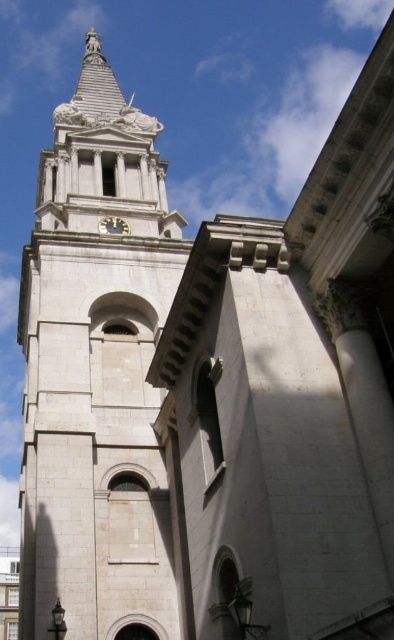
Question: Does white stone clock tower at center have a lesser width compared to black glossy clock at upper center?

Choices:
 (A) yes
 (B) no

Answer: (B)

Question: Which of the following is the closest to the observer?

Choices:
 (A) (63, 154)
 (B) (122, 224)

Answer: (B)

Question: Can you confirm if white stone clock tower at center is thinner than black glossy clock at upper center?

Choices:
 (A) no
 (B) yes

Answer: (A)

Question: Which point is farther to the camera?

Choices:
 (A) (122, 227)
 (B) (63, 266)

Answer: (A)

Question: Which point is closer to the camera taking this photo?

Choices:
 (A) (109, 228)
 (B) (89, 348)

Answer: (B)

Question: Considering the relative positions of white stone clock tower at center and black glossy clock at upper center in the image provided, where is white stone clock tower at center located with respect to black glossy clock at upper center?

Choices:
 (A) right
 (B) left

Answer: (B)